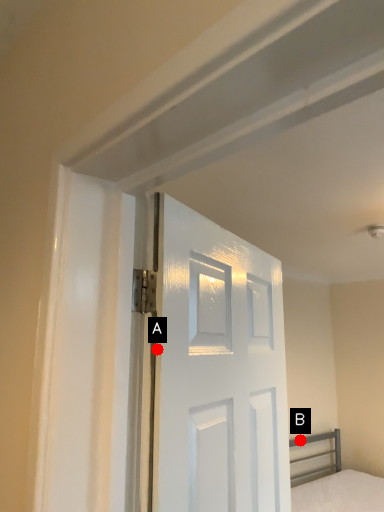
Question: Two points are circled on the image, labeled by A and B beside each circle. Which point is farther to the camera?

Choices:
 (A) A is further
 (B) B is further

Answer: (B)